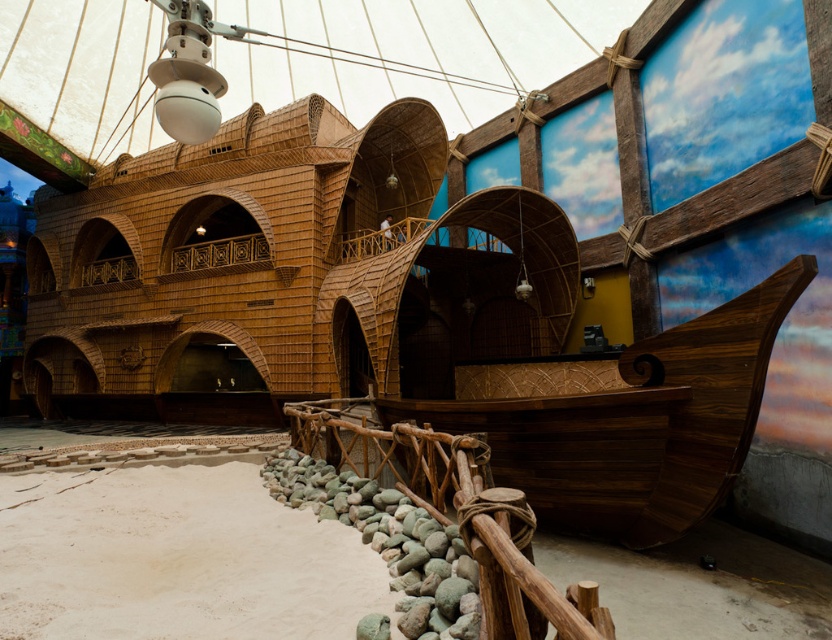
Question: Based on their relative distances, which object is farther from the rustic wood rail at lower center?

Choices:
 (A) white sand at lower center
 (B) white fabric canopy at upper center

Answer: (B)

Question: Can you confirm if white fabric canopy at upper center is wider than white sand at lower center?

Choices:
 (A) yes
 (B) no

Answer: (A)

Question: Which object is the farthest from the white sand at lower center?

Choices:
 (A) white fabric canopy at upper center
 (B) rustic wood rail at lower center

Answer: (A)

Question: Which object appears farthest from the camera in this image?

Choices:
 (A) white sand at lower center
 (B) rustic wood rail at lower center

Answer: (A)

Question: Is white fabric canopy at upper center further to the viewer compared to rustic wood rail at lower center?

Choices:
 (A) yes
 (B) no

Answer: (A)

Question: Does white fabric canopy at upper center have a greater width compared to white sand at lower center?

Choices:
 (A) no
 (B) yes

Answer: (B)